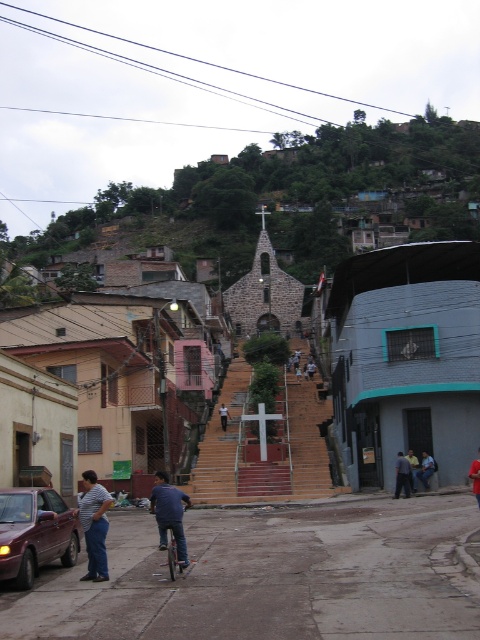
Is point (45, 532) behind point (474, 465)?

No, (45, 532) is in front of (474, 465).

Who is higher up, matte red car at lower left or red shirt at center?

matte red car at lower left is higher up.

This screenshot has width=480, height=640. Describe the element at coordinates (35, 532) in the screenshot. I see `matte red car at lower left` at that location.

At what (x,y) coordinates should I click in order to perform the action: click on matte red car at lower left. Please return your answer as a coordinate pair (x, y). The height and width of the screenshot is (640, 480). Looking at the image, I should click on (35, 532).

Who is taller, red shirt at center or dark blue shirt at lower right?

With more height is red shirt at center.

Between red shirt at center and dark blue shirt at lower right, which one is positioned lower?

dark blue shirt at lower right is lower down.

Where is `red shirt at center`? The height and width of the screenshot is (640, 480). red shirt at center is located at coordinates (476, 476).

Is stone church at center shorter than red shirt at center?

No.

Is point (442, 241) more distant than point (475, 460)?

That is True.

The height and width of the screenshot is (640, 480). Identify the location of stone church at center. (301, 202).

Locate an element on the screen. The image size is (480, 640). stone church at center is located at coordinates (301, 202).